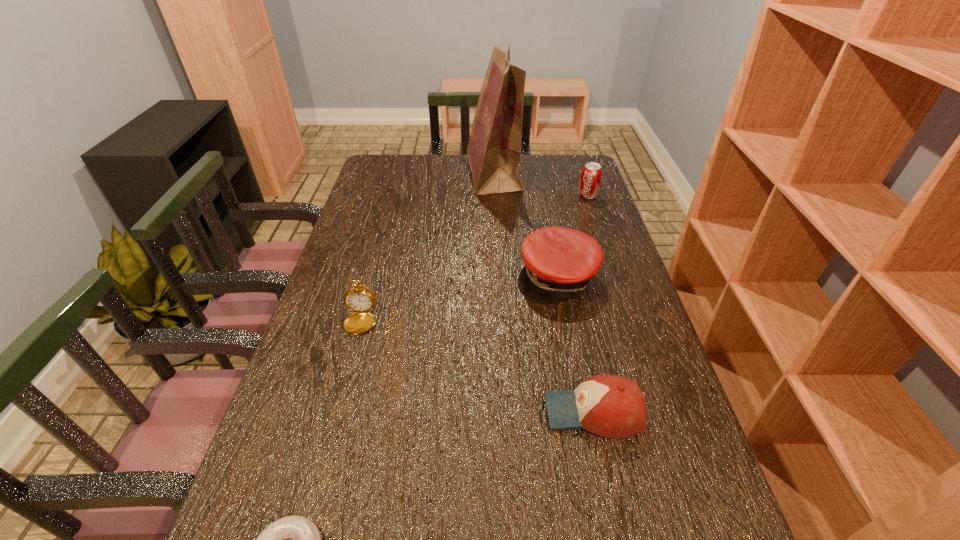
At what (x,y) coordinates should I click in order to perform the action: click on the tallest object. Please return your answer as a coordinate pair (x, y). Looking at the image, I should click on (494, 148).

Locate an element on the screen. The image size is (960, 540). the rightmost object is located at coordinates (591, 174).

You are a GUI agent. You are given a task and a screenshot of the screen. Output one action in this format:
    pyautogui.click(x=<x>, y=<y>)
    Task: Click on the third nearest object
    
    Given the screenshot: What is the action you would take?
    pyautogui.click(x=359, y=299)

At what (x,y) coordinates should I click in order to perform the action: click on the fourth nearest object. Please return your answer as a coordinate pair (x, y). This screenshot has height=540, width=960. Looking at the image, I should click on (559, 262).

Locate an element on the screen. The height and width of the screenshot is (540, 960). the second nearest object is located at coordinates (611, 406).

You are a GUI agent. You are given a task and a screenshot of the screen. Output one action in this format:
    pyautogui.click(x=<x>, y=<y>)
    Task: Click on the baseball cap
    This screenshot has height=540, width=960.
    Given the screenshot: What is the action you would take?
    pyautogui.click(x=611, y=406)

Locate an element on the screen. vacant point located 0.220m on the front-facing side of the tallest object is located at coordinates (408, 174).

Find the location of a particular element. blank space located on the front-facing side of the tallest object is located at coordinates 419,174.

Locate an element on the screen. This screenshot has height=540, width=960. free space located 0.250m on the front-facing side of the tallest object is located at coordinates (400, 174).

At what (x,y) coordinates should I click in order to perform the action: click on blank space located 0.080m on the left of the soda. Please return your answer as a coordinate pair (x, y). Looking at the image, I should click on (556, 196).